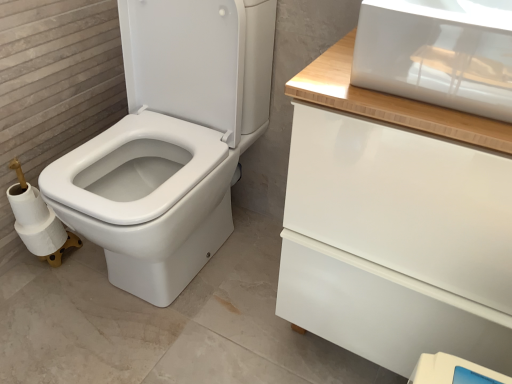
Question: Is point (8, 192) closer or farther from the camera than point (493, 302)?

Choices:
 (A) farther
 (B) closer

Answer: (A)

Question: Is white matte toilet paper at lower left bigger or smaller than white glossy drawer at upper right?

Choices:
 (A) small
 (B) big

Answer: (A)

Question: Considering the positions of white matte toilet paper at lower left and white glossy drawer at upper right in the image, is white matte toilet paper at lower left taller or shorter than white glossy drawer at upper right?

Choices:
 (A) short
 (B) tall

Answer: (A)

Question: From the image's perspective, is white glossy drawer at upper right positioned above or below white matte toilet paper at lower left?

Choices:
 (A) below
 (B) above

Answer: (B)

Question: Considering the positions of white glossy drawer at upper right and white matte toilet paper at lower left in the image, is white glossy drawer at upper right wider or thinner than white matte toilet paper at lower left?

Choices:
 (A) wide
 (B) thin

Answer: (A)

Question: Considering the positions of point (373, 201) and point (53, 241), is point (373, 201) closer or farther from the camera than point (53, 241)?

Choices:
 (A) closer
 (B) farther

Answer: (A)

Question: Visually, is white glossy drawer at upper right positioned to the left or to the right of white matte toilet paper at lower left?

Choices:
 (A) right
 (B) left

Answer: (A)